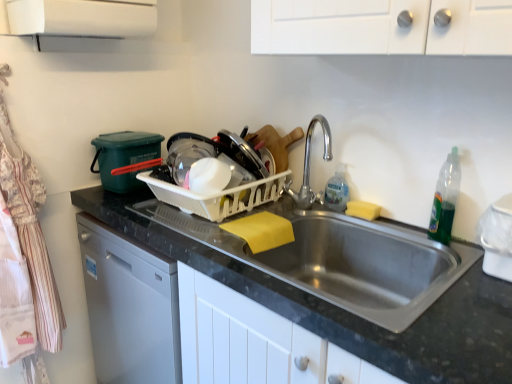
Describe the element at coordinates (332, 304) in the screenshot. The height and width of the screenshot is (384, 512). I see `black granite countertop at center` at that location.

Measure the distance between striped cotton apron at left and camera.

striped cotton apron at left and camera are 4.22 feet apart from each other.

Describe the element at coordinates (445, 199) in the screenshot. I see `green translucent bottle at right` at that location.

Locate an element on the screen. The width and height of the screenshot is (512, 384). white plastic basket at center is located at coordinates (218, 196).

You are a GUI agent. You are given a task and a screenshot of the screen. Output one action in this format:
    pyautogui.click(x=<x>, y=<y>)
    Task: Click on the clear plastic bottle at sink
    
    Given the screenshot: What is the action you would take?
    pyautogui.click(x=337, y=190)

The height and width of the screenshot is (384, 512). What do you see at coordinates (337, 190) in the screenshot?
I see `clear plastic bottle at sink` at bounding box center [337, 190].

Locate an element on the screen. The width and height of the screenshot is (512, 384). black granite countertop at center is located at coordinates (332, 304).

Is black granite countertop at center outside of white plastic basket at center?

That's correct, black granite countertop at center is outside of white plastic basket at center.

Does black granite countertop at center come behind white plastic basket at center?

That is False.

Is black granite countertop at center with white plastic basket at center?

There is a gap between black granite countertop at center and white plastic basket at center.

Is black granite countertop at center aimed at white plastic basket at center?

No, black granite countertop at center is not facing towards white plastic basket at center.

Is black granite countertop at center wider or thinner than striped cotton apron at left?

In the image, black granite countertop at center appears to be wider than striped cotton apron at left.

Between black granite countertop at center and striped cotton apron at left, which one is positioned behind?

striped cotton apron at left.

Considering the positions of objects black granite countertop at center and striped cotton apron at left in the image provided, who is more to the left, black granite countertop at center or striped cotton apron at left?

From the viewer's perspective, striped cotton apron at left appears more on the left side.

Is black granite countertop at center far from striped cotton apron at left?

No.

Is striped cotton apron at left a part of green translucent bottle at right?

Actually, striped cotton apron at left is outside green translucent bottle at right.

Considering the sizes of green translucent bottle at right and striped cotton apron at left in the image, is green translucent bottle at right wider or thinner than striped cotton apron at left?

green translucent bottle at right is thinner than striped cotton apron at left.

Is green translucent bottle at right positioned behind striped cotton apron at left?

No.

Is striped cotton apron at left at the back of green translucent bottle at right?

green translucent bottle at right is not turned away from striped cotton apron at left.

This screenshot has width=512, height=384. In order to click on bottle in front of the white plastic basket at center in this screenshot , I will do `click(445, 199)`.

Considering the relative sizes of white plastic basket at center and green translucent bottle at right in the image provided, is white plastic basket at center bigger than green translucent bottle at right?

Correct, white plastic basket at center is larger in size than green translucent bottle at right.

Between white plastic basket at center and green translucent bottle at right, which one has smaller width?

With smaller width is green translucent bottle at right.

From a real-world perspective, relative to green translucent bottle at right, is white plastic basket at center vertically above or below?

Clearly, from a real-world perspective, white plastic basket at center is below green translucent bottle at right.

In the image, is white plastic basket at center on the left side or the right side of clear plastic bottle at sink?

white plastic basket at center is positioned on clear plastic bottle at sink's left side.

Consider the image. Is clear plastic bottle at sink located within white plastic basket at center?

Actually, clear plastic bottle at sink is outside white plastic basket at center.

In the scene shown: From a real-world perspective, is white plastic basket at center beneath clear plastic bottle at sink?

Yes, from a real-world perspective, white plastic basket at center is beneath clear plastic bottle at sink.

From the image's perspective, is white plastic basket at center beneath clear plastic bottle at sink?

No, from the image's perspective, white plastic basket at center is not beneath clear plastic bottle at sink.

From the image's perspective, between white plastic basket at center and yellow sponge at sink right, which one is located above?

white plastic basket at center is shown above in the image.

Which object is positioned more to the right, white plastic basket at center or yellow sponge at sink right?

From the viewer's perspective, yellow sponge at sink right appears more on the right side.

From a real-world perspective, between white plastic basket at center and yellow sponge at sink right, who is vertically lower?

From a 3D spatial view, yellow sponge at sink right is below.

Considering the relative sizes of white plastic basket at center and yellow sponge at sink right in the image provided, is white plastic basket at center thinner than yellow sponge at sink right?

No, white plastic basket at center is not thinner than yellow sponge at sink right.

In the scene shown: Does white plastic basket at center come in front of black granite countertop at center?

No, it is behind black granite countertop at center.

From the image's perspective, is white plastic basket at center located beneath black granite countertop at center?

No.

Locate an element on the screen. The image size is (512, 384). countertop located below the white plastic basket at center (from the image's perspective) is located at coordinates (332, 304).

Locate an element on the screen. The width and height of the screenshot is (512, 384). countertop directly beneath the striped cotton apron at left (from a real-world perspective) is located at coordinates (332, 304).

When comparing their distances from yellow sponge at sink right, does black granite countertop at center or white plastic basket at center seem further?

Among the two, black granite countertop at center is located further to yellow sponge at sink right.

When comparing their distances from yellow sponge at sink right, does green translucent bottle at right or white plastic basket at center seem further?

Based on the image, white plastic basket at center appears to be further to yellow sponge at sink right.

Looking at the image, which one is located further to striped cotton apron at left, green translucent bottle at right or black granite countertop at center?

Based on the image, green translucent bottle at right appears to be further to striped cotton apron at left.

Which object lies nearer to the anchor point clear plastic bottle at sink, green translucent bottle at right or yellow sponge at sink right?

Among the two, yellow sponge at sink right is located nearer to clear plastic bottle at sink.

Considering their positions, is green translucent bottle at right positioned further to striped cotton apron at left than white plastic basket at center?

green translucent bottle at right.

Estimate the real-world distances between objects in this image. Which object is further from green translucent bottle at right, yellow sponge at sink right or clear plastic bottle at sink?

clear plastic bottle at sink.

When comparing their distances from striped cotton apron at left, does black granite countertop at center or clear plastic bottle at sink seem closer?

The object closer to striped cotton apron at left is black granite countertop at center.

Which object lies nearer to the anchor point clear plastic bottle at sink, green translucent bottle at right or white plastic basket at center?

Among the two, green translucent bottle at right is located nearer to clear plastic bottle at sink.

Identify the location of food between black granite countertop at center and clear plastic bottle at sink in the front-back direction. (362, 210).

Find the location of a particular element. The width and height of the screenshot is (512, 384). basket situated between striped cotton apron at left and green translucent bottle at right from left to right is located at coordinates 218,196.

The height and width of the screenshot is (384, 512). What are the coordinates of `basket between striped cotton apron at left and clear plastic bottle at sink in the horizontal direction` in the screenshot? It's located at (218, 196).

Where is `bottle between white plastic basket at center and black granite countertop at center in the up-down direction`? bottle between white plastic basket at center and black granite countertop at center in the up-down direction is located at coordinates (445, 199).